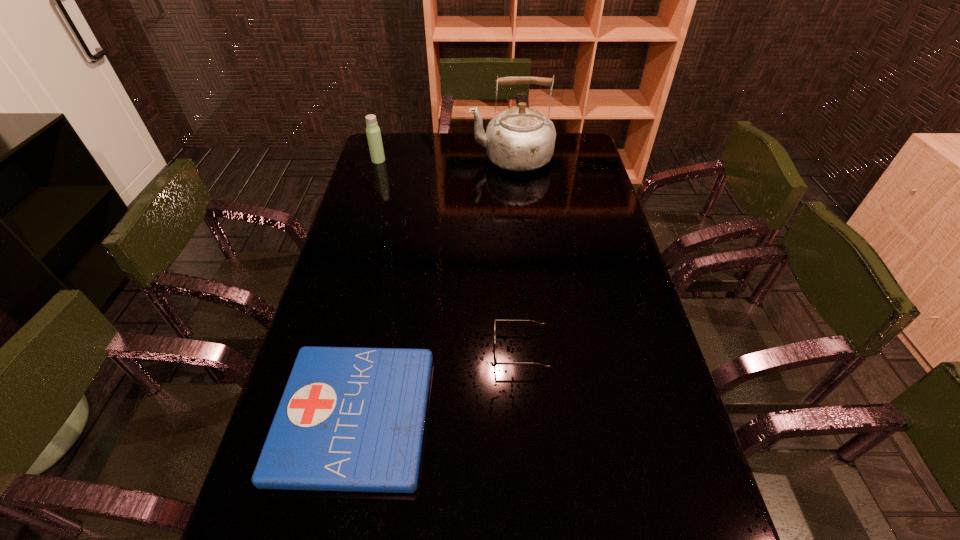
Identify the location of the tallest object. (519, 139).

Where is `the second tallest object`? the second tallest object is located at coordinates (373, 133).

The height and width of the screenshot is (540, 960). I want to click on sunglasses, so click(x=543, y=324).

I want to click on the shortest object, so (352, 419).

This screenshot has width=960, height=540. I want to click on vacant region located 0.110m at the spout of the kettle, so click(x=443, y=158).

The height and width of the screenshot is (540, 960). I want to click on vacant position located at the spout of the kettle, so click(408, 158).

This screenshot has height=540, width=960. I want to click on vacant space located at the spout of the kettle, so click(418, 158).

Identify the location of free space located on the front of the second tallest object. click(359, 225).

At what (x,y) coordinates should I click in order to perform the action: click on vacant space situated on the front lenses of the sunglasses. Please return your answer as a coordinate pair (x, y). Looking at the image, I should click on (429, 350).

Locate an element on the screen. The image size is (960, 540). free space located 0.280m on the front lenses of the sunglasses is located at coordinates (387, 350).